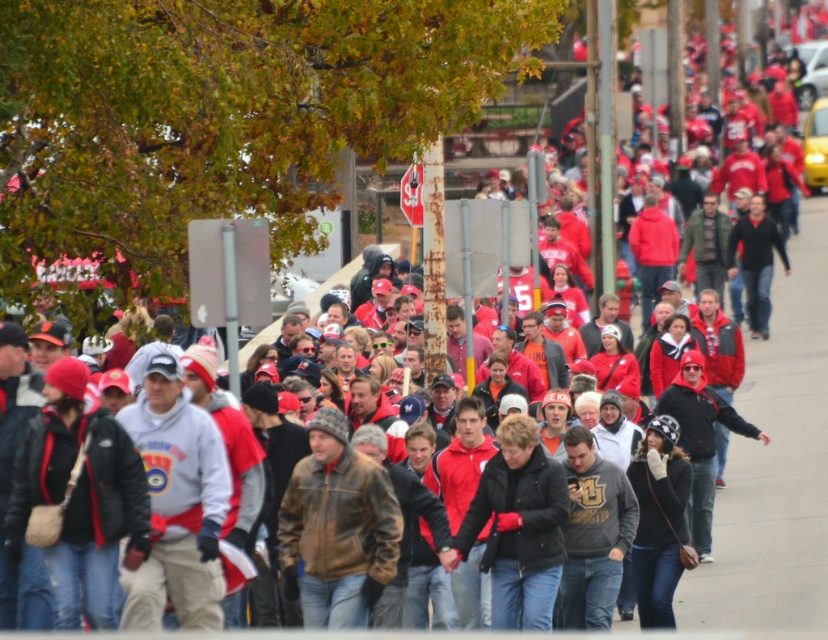
Is point (92, 492) positioned behind point (348, 522)?

That is False.

What do you see at coordinates (80, 497) in the screenshot? The image size is (828, 640). I see `matte black jacket at center` at bounding box center [80, 497].

Where is `matte black jacket at center`? This screenshot has width=828, height=640. matte black jacket at center is located at coordinates (80, 497).

Is matte black jacket at center positioned in front of black leather jacket at center?

Yes.

Image resolution: width=828 pixels, height=640 pixels. What are the coordinates of `matte black jacket at center` in the screenshot? It's located at [x=80, y=497].

In the scene shown: Who is lower down, brown leather jacket at center or black leather jacket at center?

Positioned lower is brown leather jacket at center.

Can you confirm if brown leather jacket at center is bigger than black leather jacket at center?

Indeed, brown leather jacket at center has a larger size compared to black leather jacket at center.

Who is more distant from viewer, (x=378, y=582) or (x=550, y=563)?

Positioned behind is point (x=550, y=563).

Locate an element on the screen. Image resolution: width=828 pixels, height=640 pixels. brown leather jacket at center is located at coordinates (335, 529).